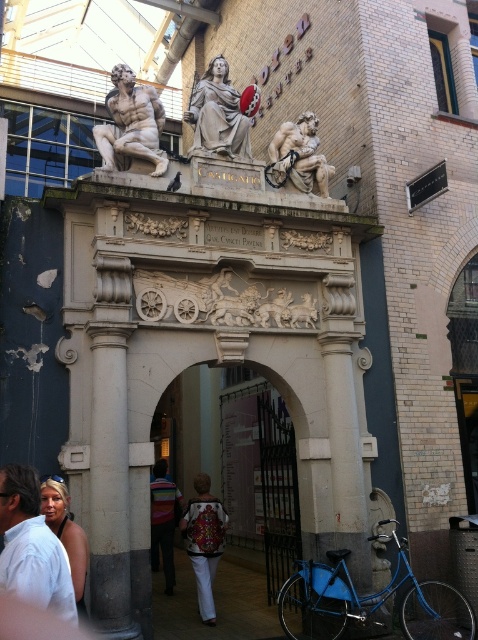
You are standing in front of the historical stone archway and want to touch both the embroidered fabric jacket at center and the rough stone sculpture at center. Which object should you reach for first?

You should reach for the embroidered fabric jacket at center first because it is closer to you than the rough stone sculpture at center.

You are a fashion designer observing a model wearing an embroidered fabric jacket at center and a striped shirt at center. Which clothing item is positioned higher on the model?

The embroidered fabric jacket at center is above the striped shirt at center, so it is positioned higher on the model.

You are standing in front of the historical stone archway and want to touch both the matte black tank top at lower left and the striped shirt at center. Which one can you reach first without moving your position?

The matte black tank top at lower left is closer to the viewer than the striped shirt at center, so you can reach it first without moving.